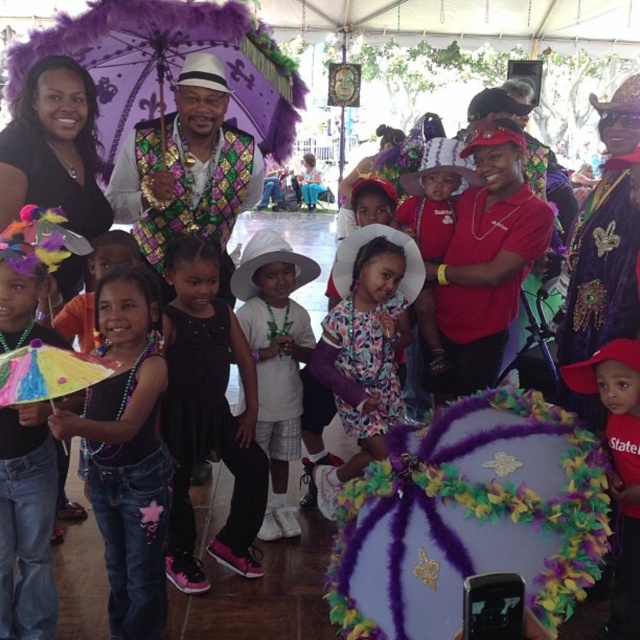
You are a photographer standing in front of the black satin dress at center and the red cotton shirt at lower right. Which one is closer to you?

The black satin dress at center is closer to you because it is further to the viewer than the red cotton shirt at lower right.

You are standing at the entrance of the tent and want to find the black satin dress at center. Based on the coordinates provided, in which direction should you look relative to your current position?

The black satin dress at center is located at coordinates point (208, 413). Since you are at the entrance, you should look towards the center of the tent to find it.